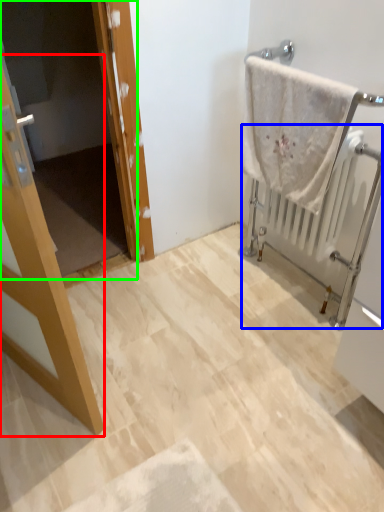
Question: Based on their relative distances, which object is nearer to door (highlighted by a red box)? Choose from radiator (highlighted by a blue box) and screen door (highlighted by a green box).

Choices:
 (A) radiator
 (B) screen door

Answer: (A)